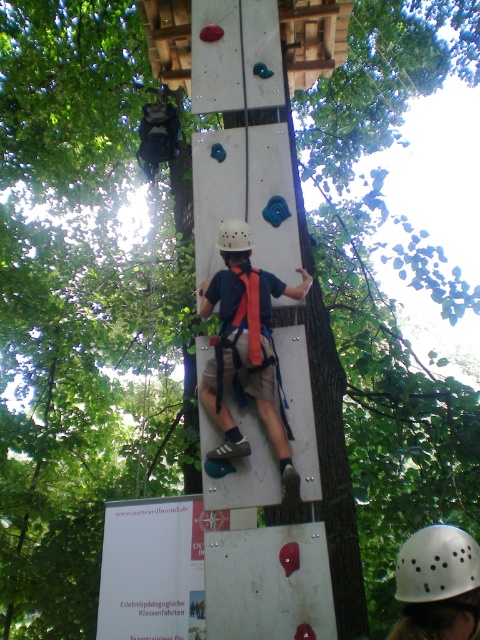
Which of these two, matte orange harness at center or white matte helmet at center, stands taller?

matte orange harness at center is taller.

Between point (257, 269) and point (249, 250), which one is positioned behind?

Positioned behind is point (257, 269).

Image resolution: width=480 pixels, height=640 pixels. Identify the location of matte orange harness at center. (248, 358).

Identify the location of matte orange harness at center. tap(248, 358).

Can you confirm if white matte helmet at lower right is thinner than white matte helmet at center?

No.

Is white matte helmet at lower right below white matte helmet at center?

Yes.

Is point (454, 580) behind point (240, 240)?

No, (454, 580) is closer to viewer.

Where is `white matte helmet at lower right`? white matte helmet at lower right is located at coordinates (436, 564).

Who is taller, matte orange harness at center or white matte helmet at lower right?

With more height is matte orange harness at center.

Can you confirm if matte orange harness at center is positioned to the right of white matte helmet at lower right?

In fact, matte orange harness at center is to the left of white matte helmet at lower right.

The width and height of the screenshot is (480, 640). What do you see at coordinates (248, 358) in the screenshot? I see `matte orange harness at center` at bounding box center [248, 358].

The height and width of the screenshot is (640, 480). In order to click on matte orange harness at center in this screenshot , I will do `click(248, 358)`.